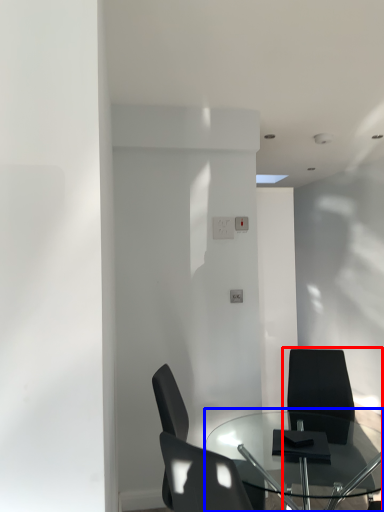
Question: Which object appears farthest to the camera in this image, chair (highlighted by a red box) or table (highlighted by a blue box)?

Choices:
 (A) chair
 (B) table

Answer: (A)